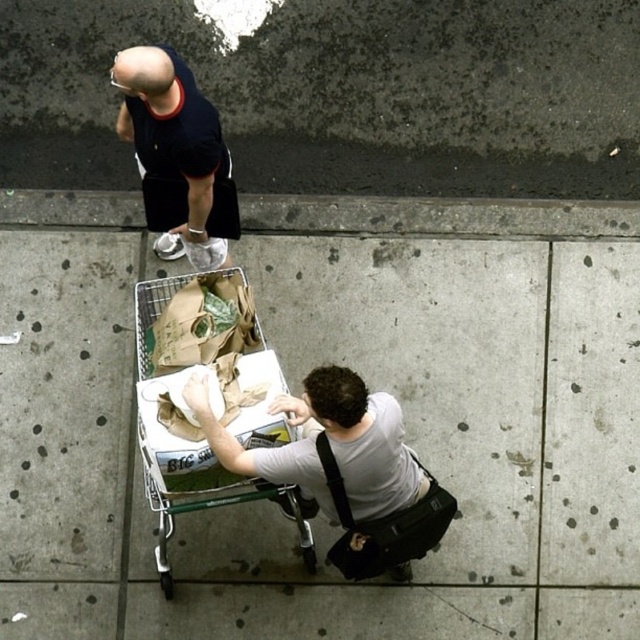
Is point (268, 356) in front of point (280, 477)?

That is False.

Looking at this image, between metallic silver shopping cart at center and white matte shirt at lower center, which one is positioned higher?

Positioned higher is white matte shirt at lower center.

Who is more distant from viewer, (195, 460) or (205, 428)?

The point (195, 460) is behind.

This screenshot has width=640, height=640. I want to click on metallic silver shopping cart at center, so click(179, 433).

Is concrete at upper center positioned in front of metallic silver shopping cart at center?

That is False.

Does point (88, 195) come in front of point (164, 493)?

No, (88, 195) is further to viewer.

Find the location of a particular element. Image resolution: width=640 pixels, height=640 pixels. concrete at upper center is located at coordinates (436, 216).

Is metallic silver shopping cart at center bigger than black matte shirt at upper left?

Correct, metallic silver shopping cart at center is larger in size than black matte shirt at upper left.

Does metallic silver shopping cart at center appear under black matte shirt at upper left?

Correct, metallic silver shopping cart at center is located below black matte shirt at upper left.

Which is in front, point (260, 444) or point (172, 200)?

Point (260, 444) is more forward.

Find the location of a particular element. The width and height of the screenshot is (640, 640). metallic silver shopping cart at center is located at coordinates (179, 433).